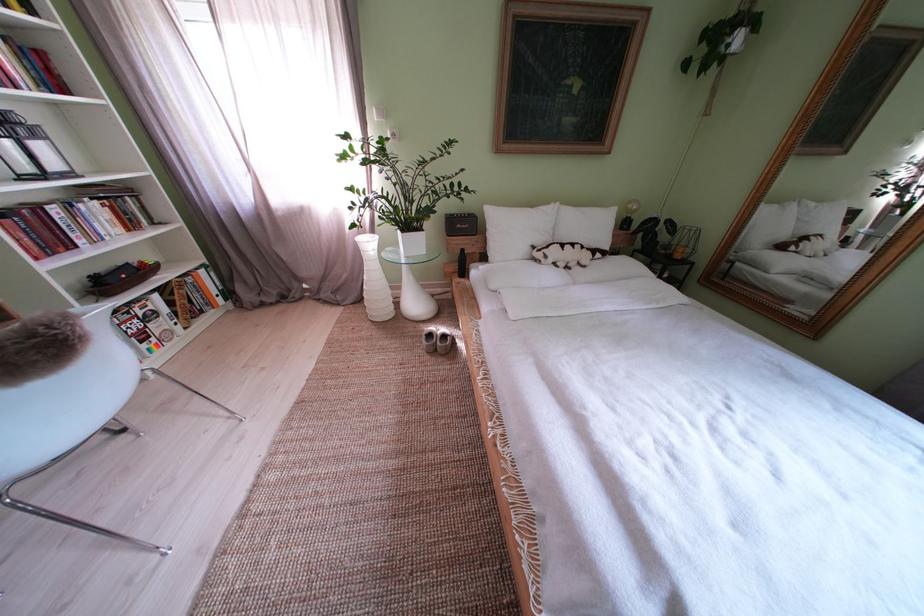
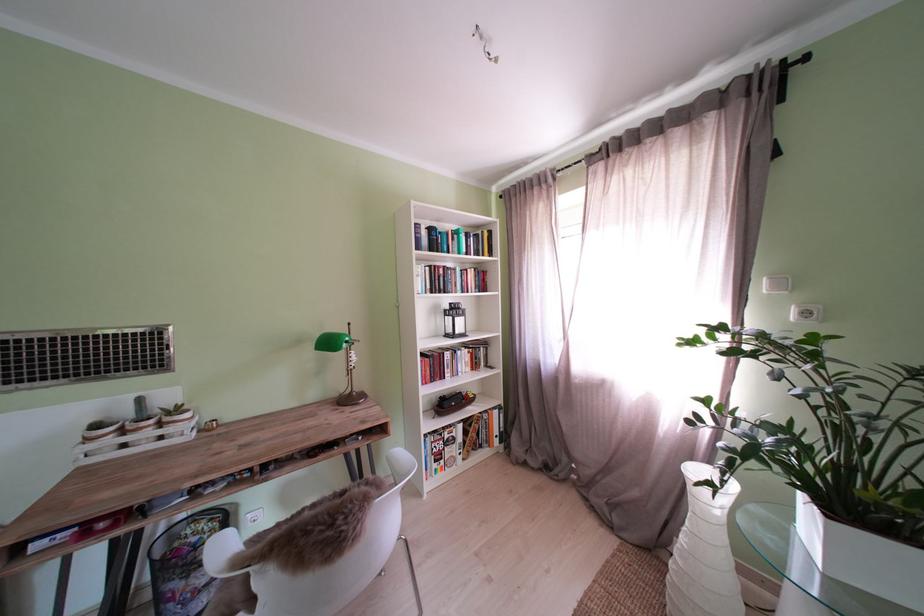
In the second image, find the point that corresponds to [431,201] in the first image.

(909, 446)